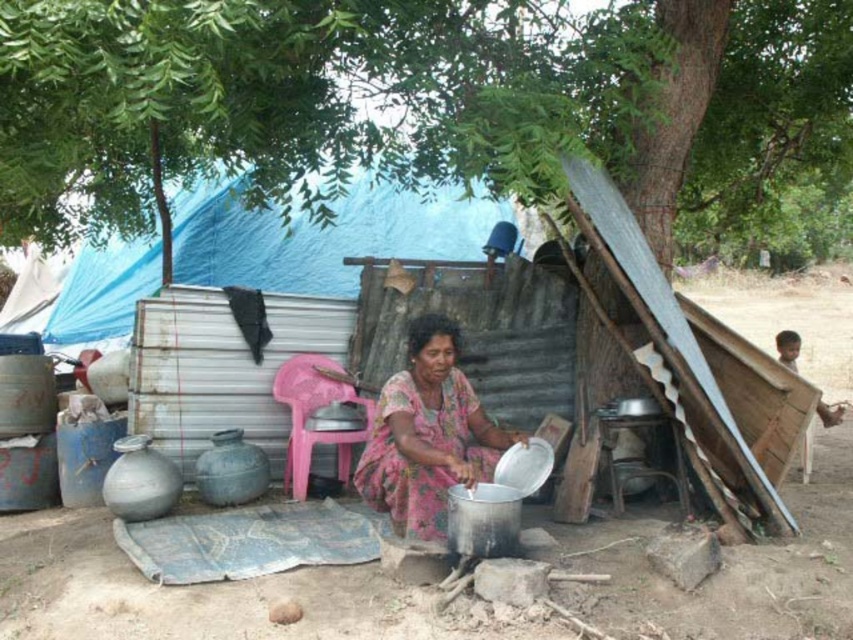
Who is positioned more to the left, blue tarpaulin tent at upper center or pink fabric dress at center?

blue tarpaulin tent at upper center is more to the left.

Measure the distance between blue tarpaulin tent at upper center and camera.

A distance of 24.61 feet exists between blue tarpaulin tent at upper center and camera.

This screenshot has width=853, height=640. Identify the location of blue tarpaulin tent at upper center. (320, 236).

Which is above, green leafy tree at upper left or blue tarpaulin tent at upper center?

green leafy tree at upper left is higher up.

Which is behind, point (68, 144) or point (444, 202)?

Point (444, 202)

Where is `green leafy tree at upper left`? The height and width of the screenshot is (640, 853). green leafy tree at upper left is located at coordinates (303, 100).

Image resolution: width=853 pixels, height=640 pixels. What are the coordinates of `green leafy tree at upper left` in the screenshot? It's located at (303, 100).

Does green leafy tree at upper left appear on the right side of pink fabric dress at center?

Yes, green leafy tree at upper left is to the right of pink fabric dress at center.

Is green leafy tree at upper left shorter than pink fabric dress at center?

Yes.

You are a GUI agent. You are given a task and a screenshot of the screen. Output one action in this format:
    pyautogui.click(x=<x>, y=<y>)
    Task: Click on the green leafy tree at upper left
    Image resolution: width=853 pixels, height=640 pixels.
    Given the screenshot: What is the action you would take?
    pyautogui.click(x=303, y=100)